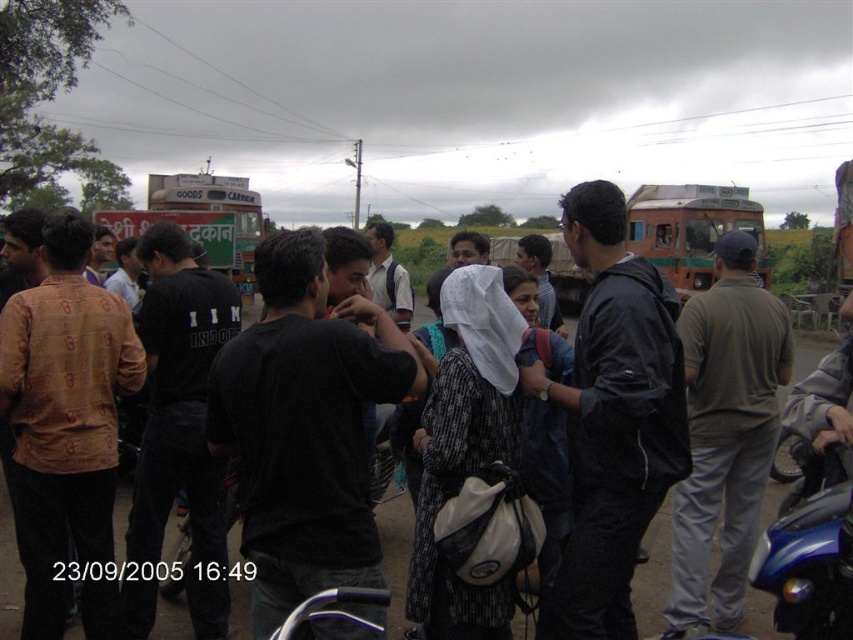
Question: Is dark blue jacket at center thinner than green painted goods carrier at upper left?

Choices:
 (A) yes
 (B) no

Answer: (A)

Question: Can you confirm if dark blue jacket at center is wider than light brown cotton shirt at center?

Choices:
 (A) yes
 (B) no

Answer: (B)

Question: Considering the real-world distances, which object is farthest from the green painted goods carrier at upper left?

Choices:
 (A) dark blue jacket at center
 (B) light brown cotton shirt at center
 (C) green painted bus at center

Answer: (A)

Question: Estimate the real-world distances between objects in this image. Which object is closer to the green painted bus at center?

Choices:
 (A) green painted goods carrier at upper left
 (B) dark blue jacket at center

Answer: (A)

Question: Can you confirm if dark blue jacket at center is bigger than light brown cotton shirt at center?

Choices:
 (A) no
 (B) yes

Answer: (A)

Question: Considering the real-world distances, which object is farthest from the light brown cotton shirt at center?

Choices:
 (A) dark blue jacket at center
 (B) green painted goods carrier at upper left
 (C) green painted bus at center

Answer: (C)